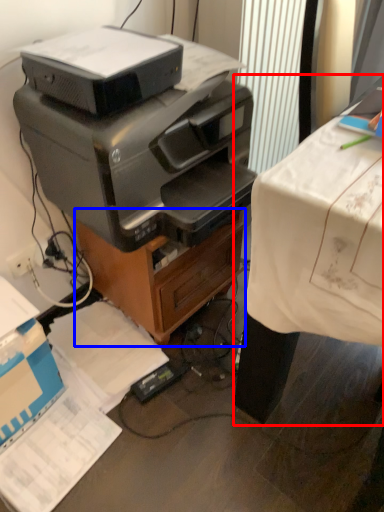
Question: Which object appears farthest to the camera in this image, desk (highlighted by a red box) or file cabinet (highlighted by a blue box)?

Choices:
 (A) desk
 (B) file cabinet

Answer: (B)